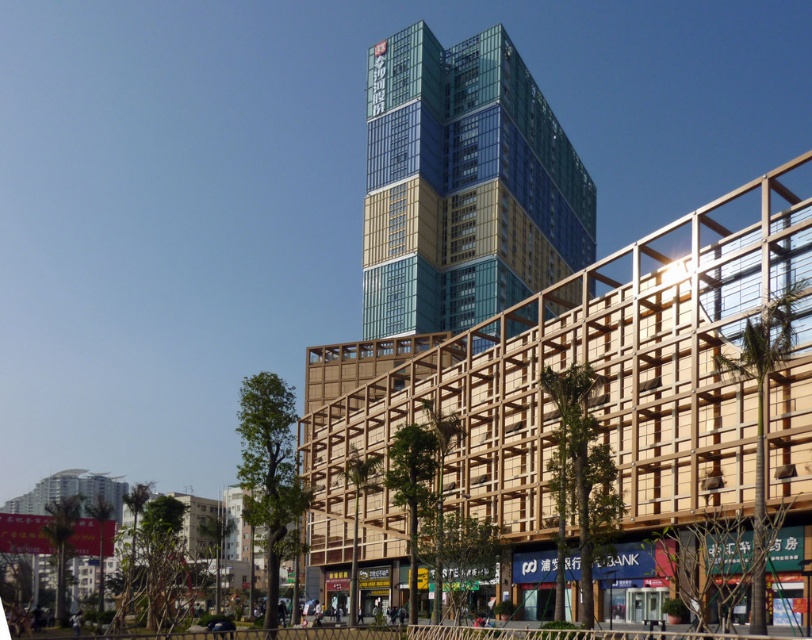
Does wooden lattice structure at center have a smaller size compared to blue glass building at center?

Incorrect, wooden lattice structure at center is not smaller in size than blue glass building at center.

From the picture: Is wooden lattice structure at center wider than blue glass building at center?

Indeed, wooden lattice structure at center has a greater width compared to blue glass building at center.

Does point (782, 396) come closer to viewer compared to point (404, 317)?

Yes, point (782, 396) is closer to viewer.

You are a GUI agent. You are given a task and a screenshot of the screen. Output one action in this format:
    pyautogui.click(x=<x>, y=<y>)
    Task: Click on the wooden lattice structure at center
    The width and height of the screenshot is (812, 640).
    Given the screenshot: What is the action you would take?
    pyautogui.click(x=603, y=388)